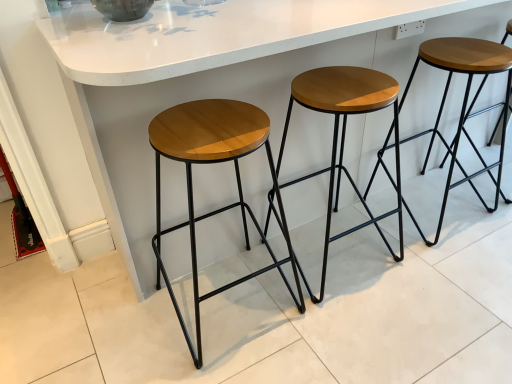
Where is `vacant area on top of wooden seat at center, acting as the 3th stool starting from the left (from a real-world perspective)`? This screenshot has width=512, height=384. vacant area on top of wooden seat at center, acting as the 3th stool starting from the left (from a real-world perspective) is located at coordinates (460, 50).